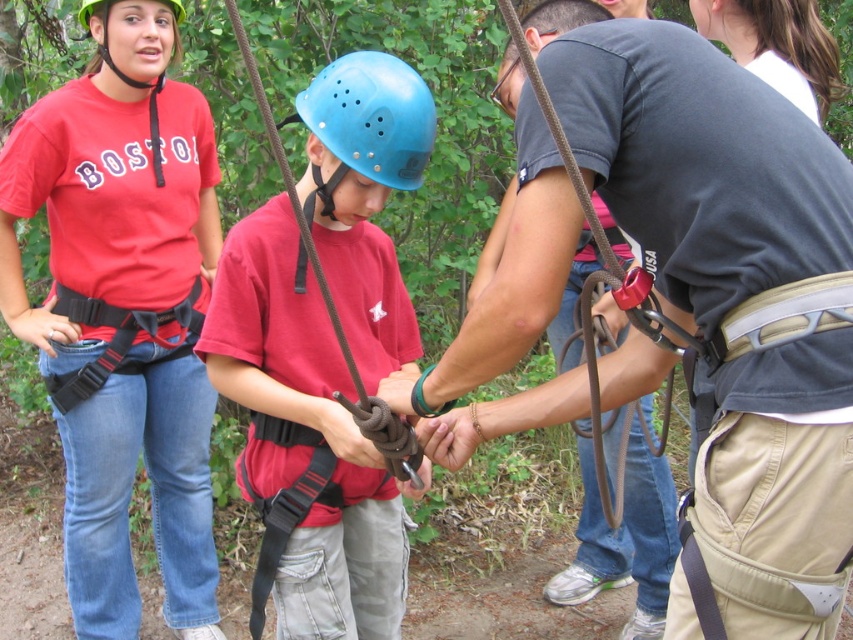
Is blue matte helmet at center to the left of hard plastic helmet at upper left from the viewer's perspective?

Incorrect, blue matte helmet at center is not on the left side of hard plastic helmet at upper left.

Who is more forward, (370, 148) or (90, 4)?

Point (370, 148)

Image resolution: width=853 pixels, height=640 pixels. Find the location of `blue matte helmet at center`. blue matte helmet at center is located at coordinates (372, 116).

This screenshot has height=640, width=853. In order to click on blue matte helmet at center in this screenshot , I will do `click(372, 116)`.

Is matte red shirt at center thinner than dark gray fabric belt at center?

No.

Can you confirm if matte red shirt at center is positioned to the left of dark gray fabric belt at center?

Correct, you'll find matte red shirt at center to the left of dark gray fabric belt at center.

Locate an element on the screen. The image size is (853, 640). matte red shirt at center is located at coordinates (123, 312).

From the picture: Does matte blue helmet at center have a larger size compared to matte green helmet at upper left?

Indeed, matte blue helmet at center has a larger size compared to matte green helmet at upper left.

Is point (360, 445) positioned after point (96, 68)?

No.

Where is `matte blue helmet at center`? matte blue helmet at center is located at coordinates (303, 440).